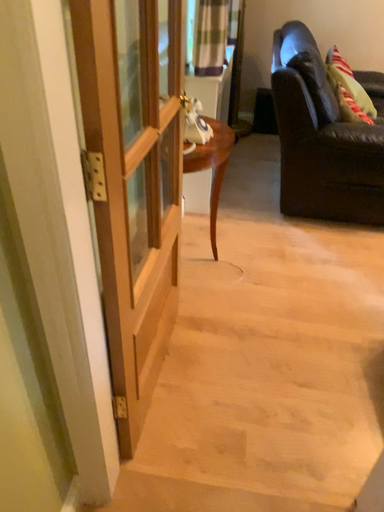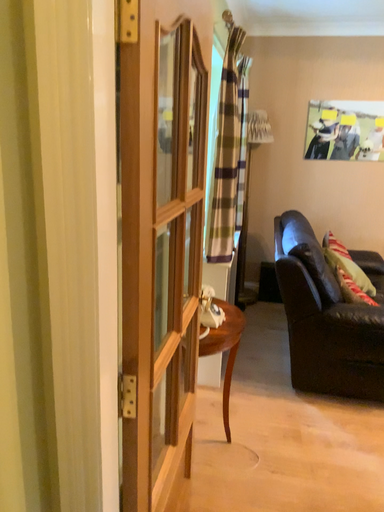
Question: Which way did the camera rotate in the video?

Choices:
 (A) rotated downward
 (B) rotated upward

Answer: (B)